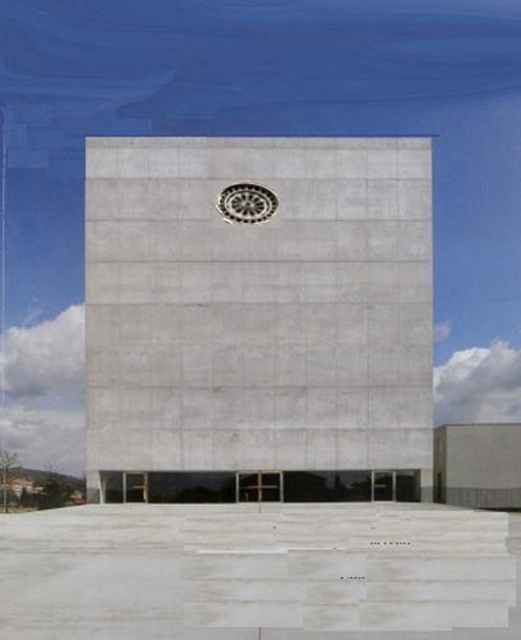
Can you confirm if gray concrete tower at center is smaller than black metal clock at center?

Incorrect, gray concrete tower at center is not smaller in size than black metal clock at center.

Does gray concrete tower at center have a larger size compared to black metal clock at center?

Correct, gray concrete tower at center is larger in size than black metal clock at center.

Is point (390, 300) behind point (221, 198)?

No, it is in front of (221, 198).

Identify the location of gray concrete tower at center. pos(258,321).